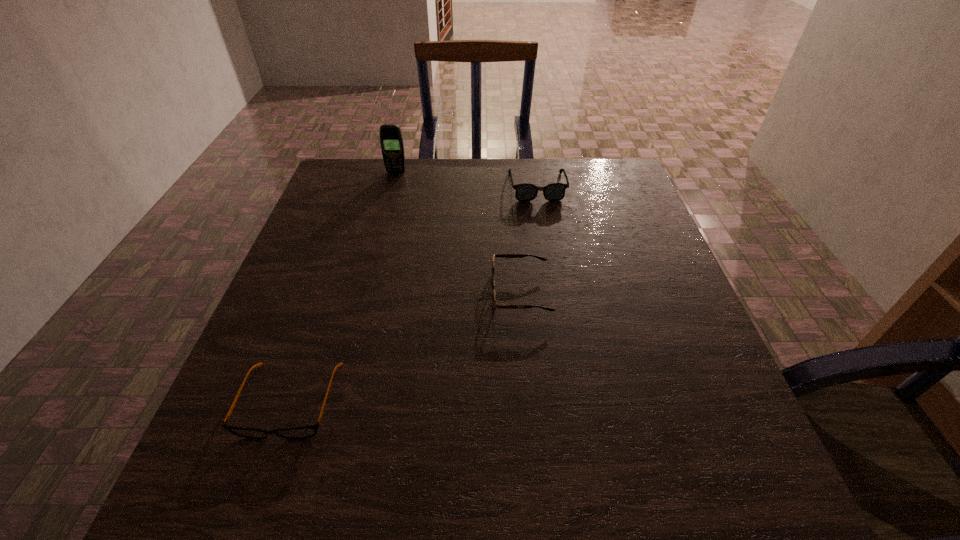
This screenshot has width=960, height=540. What are the coordinates of `vacant area situated 0.100m on the front-facing side of the leftmost spectacles` in the screenshot? It's located at (252, 509).

Identify the location of cellular telephone located in the far edge section of the desktop. (391, 140).

The width and height of the screenshot is (960, 540). I want to click on spectacles that is positioned at the far edge, so click(x=555, y=191).

What are the coordinates of `cellular telephone that is at the left edge` in the screenshot? It's located at (391, 140).

Identify the location of spectacles at the left edge. Image resolution: width=960 pixels, height=540 pixels. (309, 431).

You are a GUI agent. You are given a task and a screenshot of the screen. Output one action in this format:
    pyautogui.click(x=<x>, y=<y>)
    Task: Click on the object that is at the far left corner
    The height and width of the screenshot is (540, 960).
    Given the screenshot: What is the action you would take?
    pyautogui.click(x=391, y=140)

What are the coordinates of `vacant space at the far edge of the desktop` in the screenshot? It's located at (461, 165).

Where is `blank area at the near edge`? The height and width of the screenshot is (540, 960). blank area at the near edge is located at coordinates (396, 481).

At what (x,y) coordinates should I click in order to perform the action: click on vacant space at the left edge. Please return your answer as a coordinate pair (x, y). The width and height of the screenshot is (960, 540). Looking at the image, I should click on (279, 378).

Where is `vacant point at the right edge`? The width and height of the screenshot is (960, 540). vacant point at the right edge is located at coordinates (719, 409).